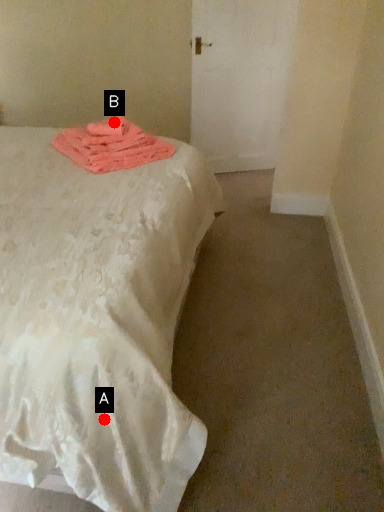
Question: Two points are circled on the image, labeled by A and B beside each circle. Which of the following is the farthest from the observer?

Choices:
 (A) A is further
 (B) B is further

Answer: (B)